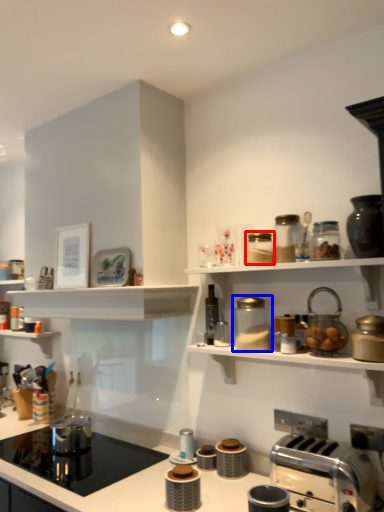
Question: Among these objects, which one is farthest to the camera, appliance (highlighted by a red box) or appliance (highlighted by a blue box)?

Choices:
 (A) appliance
 (B) appliance

Answer: (A)